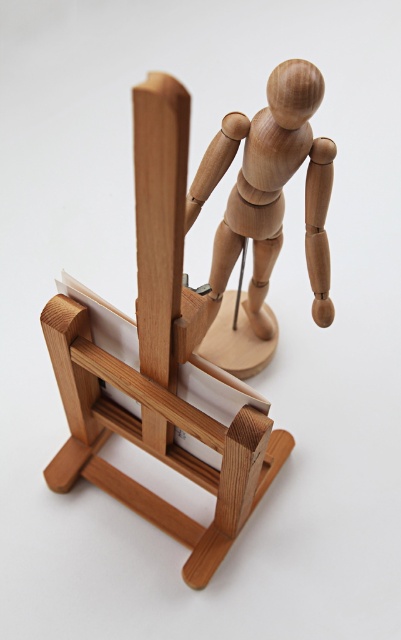
Question: Which of the following is the farthest from the observer?

Choices:
 (A) (253, 349)
 (B) (275, 156)

Answer: (A)

Question: Can you confirm if natural wood mannequin at center is thinner than natural wood mannequin at upper center?

Choices:
 (A) yes
 (B) no

Answer: (B)

Question: From the image, what is the correct spatial relationship of natural wood mannequin at center in relation to natural wood mannequin at upper center?

Choices:
 (A) left
 (B) right

Answer: (A)

Question: Can you confirm if natural wood mannequin at center is wider than natural wood mannequin at upper center?

Choices:
 (A) no
 (B) yes

Answer: (B)